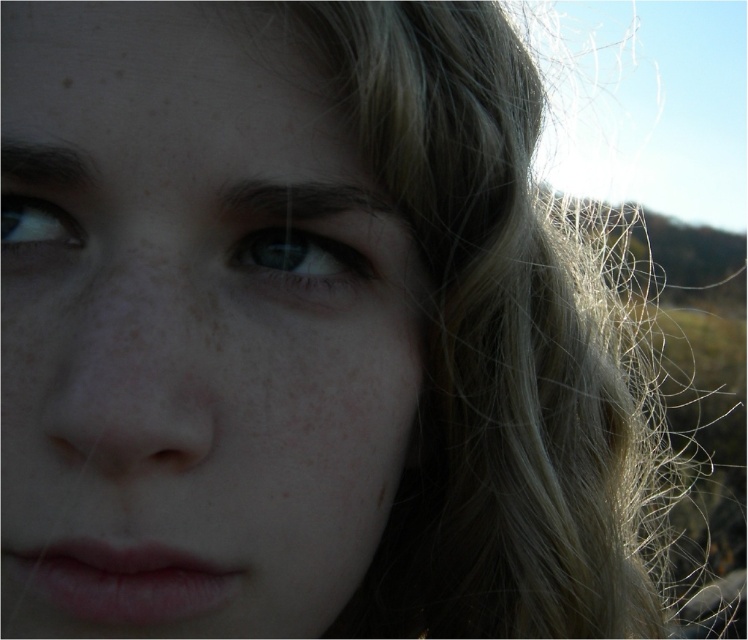
Between smooth skin face at center and matte blue eye at upper left, which one is positioned higher?

Positioned higher is matte blue eye at upper left.

Can you confirm if smooth skin face at center is positioned below matte blue eye at upper left?

Indeed, smooth skin face at center is positioned under matte blue eye at upper left.

Image resolution: width=748 pixels, height=640 pixels. What do you see at coordinates (193, 328) in the screenshot?
I see `smooth skin face at center` at bounding box center [193, 328].

Image resolution: width=748 pixels, height=640 pixels. What are the coordinates of `smooth skin face at center` in the screenshot? It's located at pyautogui.click(x=193, y=328).

The width and height of the screenshot is (748, 640). I want to click on smooth skin face at center, so [193, 328].

Is smooth skin face at center taller than blue glossy eye at center?

Yes.

Locate an element on the screen. smooth skin face at center is located at coordinates (193, 328).

Where is `smooth skin face at center`? The image size is (748, 640). smooth skin face at center is located at coordinates (193, 328).

Does blue glossy eye at center have a lesser height compared to matte blue eye at upper left?

In fact, blue glossy eye at center may be taller than matte blue eye at upper left.

Is blue glossy eye at center to the right of matte blue eye at upper left from the viewer's perspective?

Yes, blue glossy eye at center is to the right of matte blue eye at upper left.

Find the location of `blue glossy eye at center`. blue glossy eye at center is located at coordinates (298, 259).